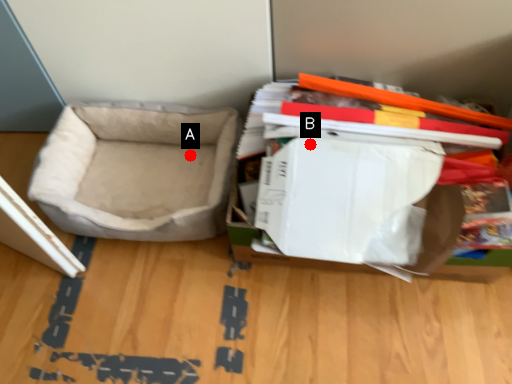
Question: Two points are circled on the image, labeled by A and B beside each circle. Which point is farther from the camera taking this photo?

Choices:
 (A) A is further
 (B) B is further

Answer: (A)